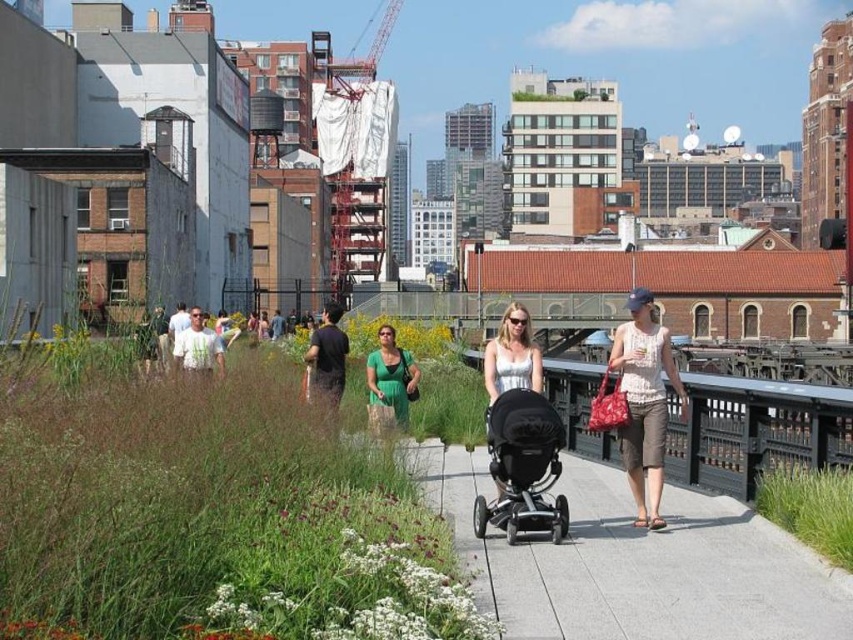
You are a fashion designer observing a group of people in an urban park. You notice a woman wearing a silver metallic dress at center and another wearing dark gray fabric pants at center. Which clothing item is narrower in width?

The silver metallic dress at center has a lesser width compared to the dark gray fabric pants at center, so the silver metallic dress at center is narrower in width.

You are a photographer standing on the pathway and want to take a photo of the black matte stroller at center and the white lace tank top at center. Which object should you focus on first if you want to capture both in the same frame without moving your camera?

The black matte stroller at center is shorter than the white lace tank top at center, so you should focus on the white lace tank top at center first to ensure both are in focus.